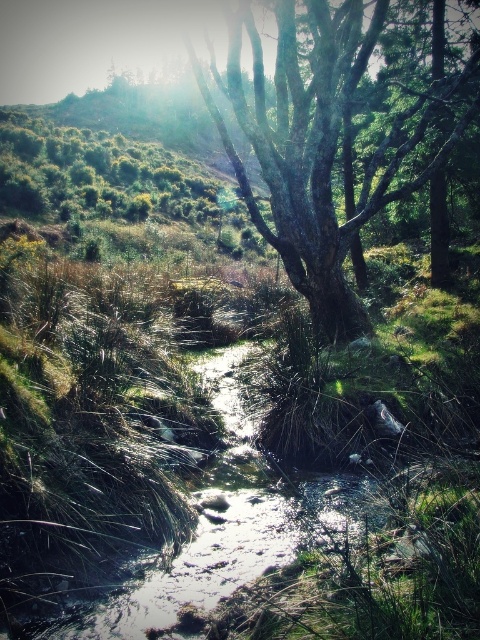
Question: Can you confirm if smooth bark tree at center is bigger than clear water at stream center?

Choices:
 (A) yes
 (B) no

Answer: (A)

Question: Which object appears closest to the camera in this image?

Choices:
 (A) smooth bark tree at center
 (B) clear water at stream center

Answer: (B)

Question: Which object appears farthest from the camera in this image?

Choices:
 (A) smooth bark tree at center
 (B) clear water at stream center

Answer: (A)

Question: Which point is farther to the camera?

Choices:
 (A) clear water at stream center
 (B) smooth bark tree at center

Answer: (B)

Question: Is smooth bark tree at center thinner than clear water at stream center?

Choices:
 (A) no
 (B) yes

Answer: (A)

Question: Can you confirm if smooth bark tree at center is positioned below clear water at stream center?

Choices:
 (A) yes
 (B) no

Answer: (B)